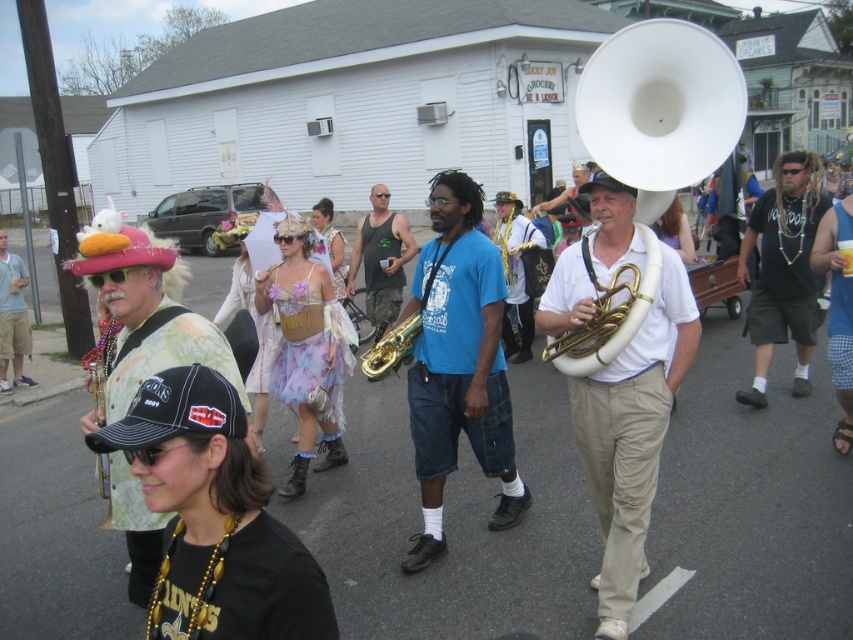
Does blue cotton t-shirt at center have a greater height compared to gold brass trumpet at center?

Correct, blue cotton t-shirt at center is much taller as gold brass trumpet at center.

Who is more forward, (495, 356) or (375, 374)?

Positioned in front is point (495, 356).

In order to click on blue cotton t-shirt at center in this screenshot , I will do `click(457, 364)`.

What do you see at coordinates (457, 364) in the screenshot? The height and width of the screenshot is (640, 853). I see `blue cotton t-shirt at center` at bounding box center [457, 364].

You are a GUI agent. You are given a task and a screenshot of the screen. Output one action in this format:
    pyautogui.click(x=<x>, y=<y>)
    Task: Click on the blue cotton t-shirt at center
    
    Given the screenshot: What is the action you would take?
    pyautogui.click(x=457, y=364)

Does white matte tuba at center appear on the right side of matte black hat at left?

Correct, you'll find white matte tuba at center to the right of matte black hat at left.

Between point (596, 456) and point (3, 368), which one is positioned behind?

The point (3, 368) is behind.

Between point (616, 468) and point (16, 371), which one is positioned behind?

The point (16, 371) is behind.

Locate an element on the screen. This screenshot has height=640, width=853. white matte tuba at center is located at coordinates (631, 435).